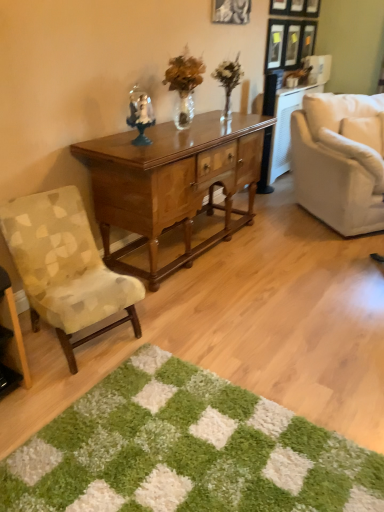
Where is `empty space that is in between polished wood desk at center and green shaggy rug at lower center`? The image size is (384, 512). empty space that is in between polished wood desk at center and green shaggy rug at lower center is located at coordinates (238, 328).